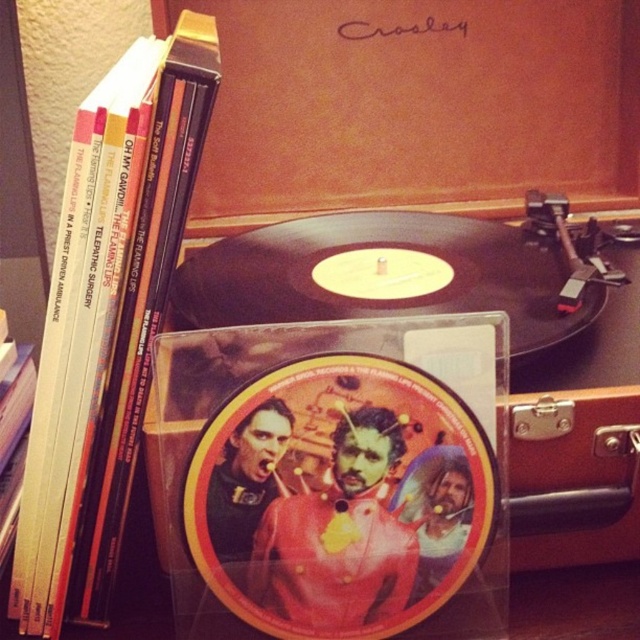
You have a storage box that can only fit items up to the size of the hardcover book at left. Can the matte vinyl record at center fit inside the storage box?

The matte vinyl record at center is larger in width than the hardcover book at left, so it cannot fit into the storage box designed for items up to the size of the hardcover book at left.

You are organizing a music collection and need to place the matte vinyl record at center and the hardcover book at left into a storage box. Based on their positions in the image, which item should you place first into the box to maintain their original arrangement?

The hardcover book at left should be placed first into the box because the matte vinyl record at center is located below it, meaning the book is above the record and needs to be placed first to maintain the original arrangement.